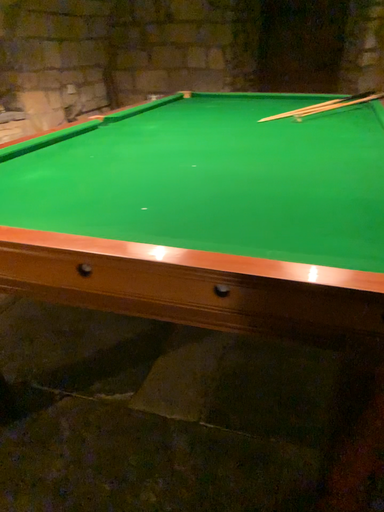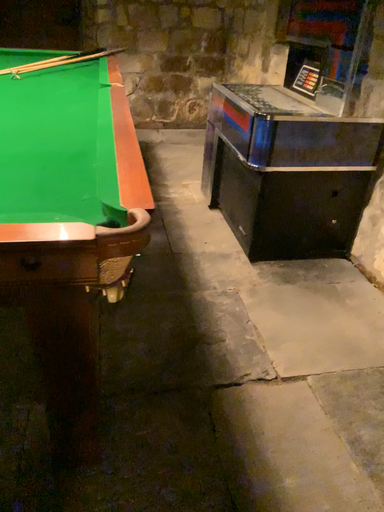
Question: Which way did the camera rotate in the video?

Choices:
 (A) rotated right
 (B) rotated left

Answer: (A)